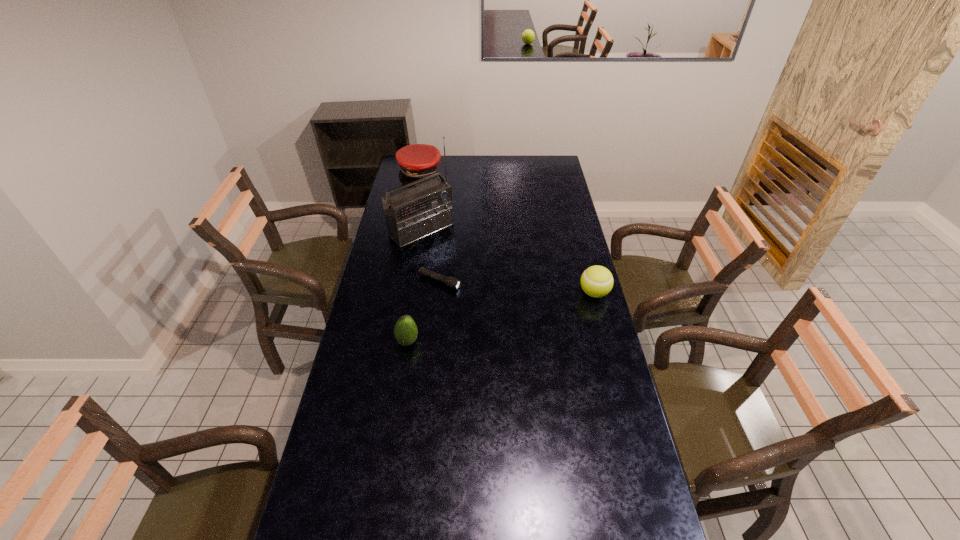
Image resolution: width=960 pixels, height=540 pixels. In order to click on the nearest object in this screenshot , I will do `click(405, 331)`.

What are the coordinates of `the rightmost object` in the screenshot? It's located at (597, 281).

Identify the location of the second farthest object. This screenshot has height=540, width=960. (412, 213).

This screenshot has width=960, height=540. I want to click on the tallest object, so click(412, 213).

Find the location of a particular element. This screenshot has width=960, height=540. flashlight is located at coordinates (451, 282).

The height and width of the screenshot is (540, 960). What are the coordinates of `cap` in the screenshot? It's located at (416, 161).

Identify the location of vacant space positioned on the right of the avocado. This screenshot has width=960, height=540. (486, 342).

Where is `vacant space positioned on the left of the rightmost object`? The width and height of the screenshot is (960, 540). vacant space positioned on the left of the rightmost object is located at coordinates (545, 293).

Identify the location of vacant space located on the front panel of the second farthest object. Image resolution: width=960 pixels, height=540 pixels. (462, 264).

Find the location of a particular element. This screenshot has height=540, width=960. vacant space located 0.120m on the front panel of the second farthest object is located at coordinates (455, 258).